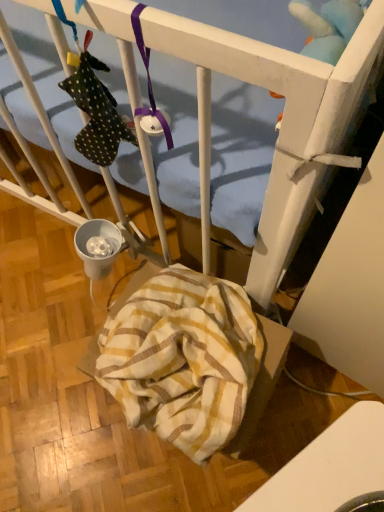
Locate an element on the screen. This screenshot has height=512, width=384. free space that is to the left of yellow striped fabric at lower center is located at coordinates (62, 391).